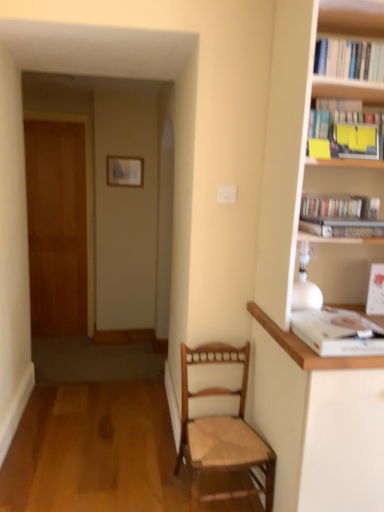
This screenshot has width=384, height=512. What do you see at coordinates (343, 227) in the screenshot?
I see `hardcover book at upper right, marked as the 4th book in a top-to-bottom arrangement` at bounding box center [343, 227].

The image size is (384, 512). What do you see at coordinates (222, 431) in the screenshot?
I see `light brown wood chair at lower center` at bounding box center [222, 431].

This screenshot has width=384, height=512. I want to click on white paper book at upper right, which is counted as the first book, starting from the bottom, so [x=337, y=332].

Measure the distance between white paper book at upper right, which is counted as the first book, starting from the bottom, and camera.

The distance of white paper book at upper right, which is counted as the first book, starting from the bottom, from camera is 4.58 feet.

The image size is (384, 512). I want to click on hardcover book at upper right, the 2th book in the bottom-to-top sequence, so click(x=343, y=227).

From a real-world perspective, is white paperbacks at upper right, the 5th book ordered from the bottom, physically located above or below white paper book at upper right, the fifth book positioned from the top?

white paperbacks at upper right, the 5th book ordered from the bottom, is situated higher than white paper book at upper right, the fifth book positioned from the top, in the real world.

Is point (382, 47) positioned after point (344, 348)?

Yes, it is.

Does white paperbacks at upper right, the 5th book ordered from the bottom, have a greater height compared to white paper book at upper right, the fifth book positioned from the top?

Correct, white paperbacks at upper right, the 5th book ordered from the bottom, is much taller as white paper book at upper right, the fifth book positioned from the top.

From the image's perspective, relative to white paper book at upper right, the fifth book positioned from the top, is white paperbacks at upper right, arranged as the first book when viewed from the top, above or below?

From the image's perspective, white paperbacks at upper right, arranged as the first book when viewed from the top, appears above white paper book at upper right, the fifth book positioned from the top.

Can you tell me how much yellow paper at upper right, acting as the 2th book starting from the top, and hardcover book at upper right, marked as the 4th book in a top-to-bottom arrangement, differ in facing direction?

The facing directions of yellow paper at upper right, acting as the 2th book starting from the top, and hardcover book at upper right, marked as the 4th book in a top-to-bottom arrangement, are 0.00152 degrees apart.

Is point (338, 111) positioned in front of point (319, 231)?

That is False.

Looking at the image, does yellow paper at upper right, acting as the 2th book starting from the top, seem bigger or smaller compared to hardcover book at upper right, the 2th book in the bottom-to-top sequence?

In the image, yellow paper at upper right, acting as the 2th book starting from the top, appears to be larger than hardcover book at upper right, the 2th book in the bottom-to-top sequence.

Is yellow paper at upper right, acting as the 2th book starting from the top, taller than hardcover book at upper right, marked as the 4th book in a top-to-bottom arrangement?

Yes, yellow paper at upper right, acting as the 2th book starting from the top, is taller than hardcover book at upper right, marked as the 4th book in a top-to-bottom arrangement.

At what (x,y) coordinates should I click in order to perform the action: click on the 1st book in front when counting from the white paperbacks at upper right, the 5th book ordered from the bottom. Please return your answer as a coordinate pair (x, y). The width and height of the screenshot is (384, 512). Looking at the image, I should click on (343, 227).

Does white paperbacks at upper right, the 5th book ordered from the bottom, have a larger size compared to hardcover book at upper right, the 2th book in the bottom-to-top sequence?

Indeed, white paperbacks at upper right, the 5th book ordered from the bottom, has a larger size compared to hardcover book at upper right, the 2th book in the bottom-to-top sequence.

From the image's perspective, is white paperbacks at upper right, the 5th book ordered from the bottom, under hardcover book at upper right, marked as the 4th book in a top-to-bottom arrangement?

No, from the image's perspective, white paperbacks at upper right, the 5th book ordered from the bottom, is not below hardcover book at upper right, marked as the 4th book in a top-to-bottom arrangement.

Does point (346, 61) appear closer or farther from the camera than point (301, 223)?

Point (346, 61) appears to be farther away from the viewer than point (301, 223).

Is hardcover book at upper right, marked as the 4th book in a top-to-bottom arrangement, oriented towards wooden door at left?

No, hardcover book at upper right, marked as the 4th book in a top-to-bottom arrangement, is not turned towards wooden door at left.

Which of these two, hardcover book at upper right, the 2th book in the bottom-to-top sequence, or wooden door at left, is smaller?

hardcover book at upper right, the 2th book in the bottom-to-top sequence, is smaller.

How much distance is there between hardcover book at upper right, the 2th book in the bottom-to-top sequence, and wooden door at left?

2.91 meters.

Consider the image. Are wooden picture frame at upper center and white paperbacks at upper right, arranged as the first book when viewed from the top, located far from each other?

Yes.

Considering the sizes of wooden picture frame at upper center and white paperbacks at upper right, arranged as the first book when viewed from the top, in the image, is wooden picture frame at upper center taller or shorter than white paperbacks at upper right, arranged as the first book when viewed from the top,?

wooden picture frame at upper center is taller than white paperbacks at upper right, arranged as the first book when viewed from the top.

Is wooden picture frame at upper center facing away from white paperbacks at upper right, arranged as the first book when viewed from the top?

No.

Locate an element on the screen. This screenshot has height=512, width=384. the 2nd book directly above the wooden picture frame at upper center (from a real-world perspective) is located at coordinates (349, 59).

Consider the image. Is hardcover books at upper right, the 3th book when ordered from top to bottom, smaller than yellow paper at upper right, which appears as the fourth book when ordered from the bottom?

Yes.

From the image's perspective, between hardcover books at upper right, the 3th book when ordered from top to bottom, and yellow paper at upper right, acting as the 2th book starting from the top, who is located below?

hardcover books at upper right, the 3th book when ordered from top to bottom, appears lower in the image.

Is hardcover books at upper right, the third book ordered from the bottom, with yellow paper at upper right, acting as the 2th book starting from the top?

They are not placed beside each other.

Is point (372, 231) farther from viewer compared to point (340, 110)?

No, (372, 231) is closer to viewer.

Which is behind, hardcover book at upper right, the 2th book in the bottom-to-top sequence, or light brown wood chair at lower center?

light brown wood chair at lower center is further away from the camera.

Consider the image. Is hardcover book at upper right, the 2th book in the bottom-to-top sequence, facing away from light brown wood chair at lower center?

No, light brown wood chair at lower center is not at the back of hardcover book at upper right, the 2th book in the bottom-to-top sequence.

From the picture: Is hardcover book at upper right, marked as the 4th book in a top-to-bottom arrangement, beside light brown wood chair at lower center?

No, hardcover book at upper right, marked as the 4th book in a top-to-bottom arrangement, is not in contact with light brown wood chair at lower center.

Between hardcover book at upper right, the 2th book in the bottom-to-top sequence, and light brown wood chair at lower center, which one has smaller width?

Thinner between the two is hardcover book at upper right, the 2th book in the bottom-to-top sequence.

Starting from the white paper book at upper right, which is counted as the first book, starting from the bottom, which book is the 2nd one behind? Please provide its 2D coordinates.

[(349, 59)]

Where is `the 2nd book located above the hardcover book at upper right, marked as the 4th book in a top-to-bottom arrangement (from a real-world perspective)`? This screenshot has width=384, height=512. the 2nd book located above the hardcover book at upper right, marked as the 4th book in a top-to-bottom arrangement (from a real-world perspective) is located at coordinates (349, 128).

When comparing their distances from hardcover books at upper right, the 3th book when ordered from top to bottom, does yellow paper at upper right, which appears as the fourth book when ordered from the bottom, or wooden picture frame at upper center seem further?

wooden picture frame at upper center is further to hardcover books at upper right, the 3th book when ordered from top to bottom.

When comparing their distances from light brown wood chair at lower center, does hardcover book at upper right, marked as the 4th book in a top-to-bottom arrangement, or wooden desk at right seem closer?

The object closer to light brown wood chair at lower center is wooden desk at right.

From the image, which object appears to be farther from hardcover books at upper right, the third book ordered from the bottom, white paperbacks at upper right, the 5th book ordered from the bottom, or white paper book at upper right, which is counted as the first book, starting from the bottom?

The object further to hardcover books at upper right, the third book ordered from the bottom, is white paperbacks at upper right, the 5th book ordered from the bottom.

In the scene shown: Based on their spatial positions, is yellow paper at upper right, which appears as the fourth book when ordered from the bottom, or white paper book at upper right, which is counted as the first book, starting from the bottom, further from hardcover books at upper right, the 3th book when ordered from top to bottom?

Among the two, white paper book at upper right, which is counted as the first book, starting from the bottom, is located further to hardcover books at upper right, the 3th book when ordered from top to bottom.

Based on the photo, which object lies nearer to the anchor point white paperbacks at upper right, the 5th book ordered from the bottom, wooden desk at right or yellow paper at upper right, acting as the 2th book starting from the top?

yellow paper at upper right, acting as the 2th book starting from the top.

When comparing their distances from yellow paper at upper right, acting as the 2th book starting from the top, does light brown wood chair at lower center or hardcover books at upper right, the third book ordered from the bottom, seem closer?

Among the two, hardcover books at upper right, the third book ordered from the bottom, is located nearer to yellow paper at upper right, acting as the 2th book starting from the top.

When comparing their distances from wooden picture frame at upper center, does hardcover book at upper right, the 2th book in the bottom-to-top sequence, or light brown wood chair at lower center seem closer?

light brown wood chair at lower center is closer to wooden picture frame at upper center.

Considering their positions, is white paperbacks at upper right, arranged as the first book when viewed from the top, positioned further to hardcover book at upper right, marked as the 4th book in a top-to-bottom arrangement, than wooden desk at right?

A: wooden desk at right is further to hardcover book at upper right, marked as the 4th book in a top-to-bottom arrangement.

Where is `picture frame located between white paper book at upper right, the fifth book positioned from the top, and wooden door at left in the depth direction`? The width and height of the screenshot is (384, 512). picture frame located between white paper book at upper right, the fifth book positioned from the top, and wooden door at left in the depth direction is located at coordinates (125, 170).

At what (x,y) coordinates should I click in order to perform the action: click on chair between white paper book at upper right, the fifth book positioned from the top, and wooden picture frame at upper center, along the z-axis. Please return your answer as a coordinate pair (x, y). This screenshot has height=512, width=384. Looking at the image, I should click on (222, 431).

The height and width of the screenshot is (512, 384). What are the coordinates of `chair between hardcover book at upper right, the 2th book in the bottom-to-top sequence, and wooden door at left from front to back` in the screenshot? It's located at (222, 431).

Where is `chair between wooden desk at right and wooden door at left in the front-back direction`? The image size is (384, 512). chair between wooden desk at right and wooden door at left in the front-back direction is located at coordinates (222, 431).